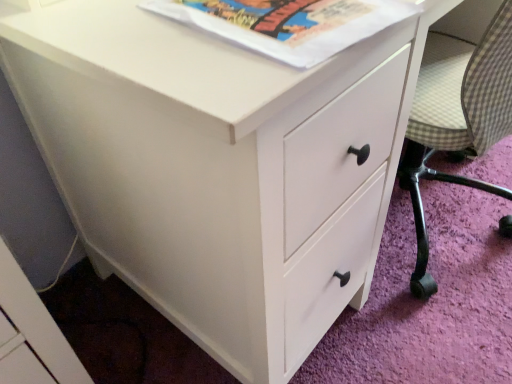
You are a GUI agent. You are given a task and a screenshot of the screen. Output one action in this format:
    pyautogui.click(x=<x>, y=<y>)
    Task: Click on the free point above white paper at upper center (from a real-world perspective)
    
    Given the screenshot: What is the action you would take?
    pyautogui.click(x=282, y=16)